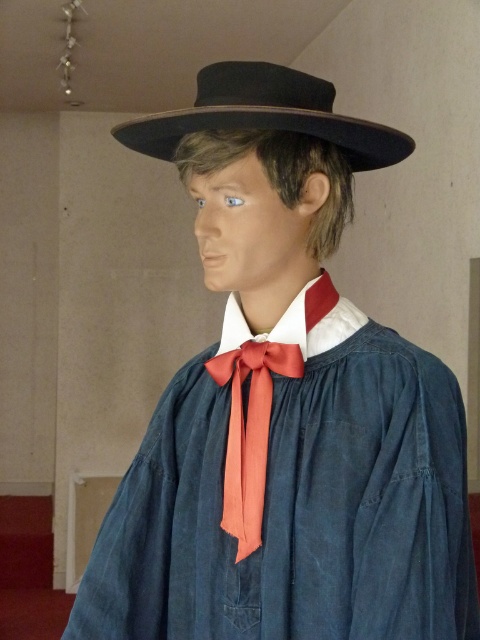
Question: In this image, where is black felt fedora at upper center located relative to satin orange bow tie at center?

Choices:
 (A) right
 (B) left

Answer: (B)

Question: Which point is farther from the camera taking this photo?

Choices:
 (A) (216, 74)
 (B) (207, 365)

Answer: (B)

Question: Does black felt fedora at upper center have a larger size compared to satin orange bow tie at center?

Choices:
 (A) yes
 (B) no

Answer: (A)

Question: Does black felt fedora at upper center have a greater width compared to satin orange bow tie at center?

Choices:
 (A) yes
 (B) no

Answer: (A)